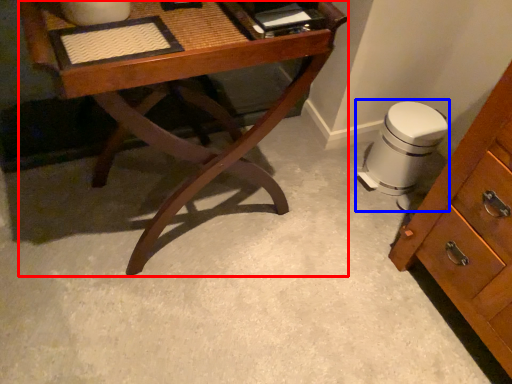
Question: Which object appears farthest to the camera in this image, desk (highlighted by a red box) or swivel chair (highlighted by a blue box)?

Choices:
 (A) desk
 (B) swivel chair

Answer: (B)